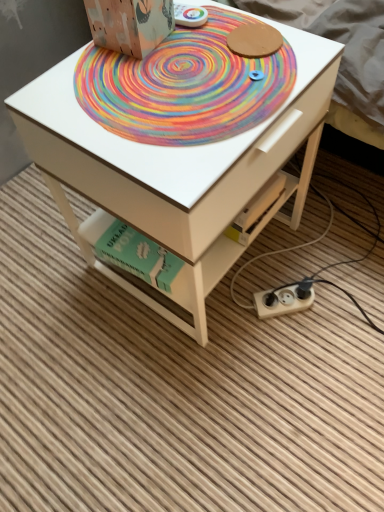
Find the location of a particular element. free space behind white plastic plug at lower right is located at coordinates (281, 257).